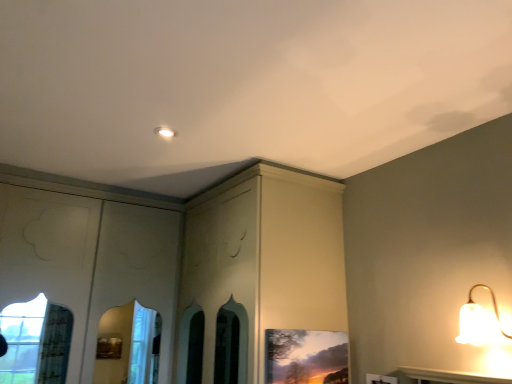
Looking at this image, what is the approximate width of matte wooden picture frame at lower center?

The width of matte wooden picture frame at lower center is 2.00 inches.

In order to face matte wooden picture frame at lower center, should I rotate leftwards or rightwards?

A 7.370 degree turn to the right will do.

What do you see at coordinates (305, 356) in the screenshot? The image size is (512, 384). I see `matte wooden picture frame at lower center` at bounding box center [305, 356].

Measure the distance between matte wooden picture frame at lower center and camera.

A distance of 2.14 meters exists between matte wooden picture frame at lower center and camera.

Measure the distance between point (288, 343) and camera.

The distance of point (288, 343) from camera is 7.32 feet.

What are the coordinates of `matte wooden picture frame at lower center` in the screenshot? It's located at (305, 356).

In order to face white frosted glass lamp at upper right, should I rotate leftwards or rightwards?

To align with it, rotate right about 29.330°.

Identify the location of white frosted glass lamp at upper right. (479, 321).

Describe the element at coordinates (479, 321) in the screenshot. I see `white frosted glass lamp at upper right` at that location.

At what (x,y) coordinates should I click in order to perform the action: click on matte wooden picture frame at lower center. Please return your answer as a coordinate pair (x, y). This screenshot has width=512, height=384. Looking at the image, I should click on [305, 356].

Does white frosted glass lamp at upper right appear on the left side of matte wooden picture frame at lower center?

Incorrect, white frosted glass lamp at upper right is not on the left side of matte wooden picture frame at lower center.

Who is more distant, white frosted glass lamp at upper right or matte wooden picture frame at lower center?

Positioned behind is matte wooden picture frame at lower center.

Between point (477, 317) and point (331, 380), which one is positioned in front?

The point (477, 317) is closer.

From the image's perspective, which one is positioned lower, white frosted glass lamp at upper right or matte wooden picture frame at lower center?

matte wooden picture frame at lower center is shown below in the image.

From a real-world perspective, does white frosted glass lamp at upper right sit lower than matte wooden picture frame at lower center?

No.

Does white frosted glass lamp at upper right have a greater width compared to matte wooden picture frame at lower center?

Indeed, white frosted glass lamp at upper right has a greater width compared to matte wooden picture frame at lower center.

Can you confirm if white frosted glass lamp at upper right is taller than matte wooden picture frame at lower center?

No, white frosted glass lamp at upper right is not taller than matte wooden picture frame at lower center.

Considering the sizes of objects white frosted glass lamp at upper right and matte wooden picture frame at lower center in the image provided, who is smaller, white frosted glass lamp at upper right or matte wooden picture frame at lower center?

matte wooden picture frame at lower center.

Which is correct: white frosted glass lamp at upper right is inside matte wooden picture frame at lower center, or outside of it?

white frosted glass lamp at upper right is spatially situated outside matte wooden picture frame at lower center.

Is white frosted glass lamp at upper right not close to matte wooden picture frame at lower center?

No.

In the scene shown: Is white frosted glass lamp at upper right aimed at matte wooden picture frame at lower center?

No, white frosted glass lamp at upper right is not oriented towards matte wooden picture frame at lower center.

Can you tell me how much white frosted glass lamp at upper right and matte wooden picture frame at lower center differ in facing direction?

There is a 88.8-degree angle between the facing directions of white frosted glass lamp at upper right and matte wooden picture frame at lower center.

Locate an element on the screen. The image size is (512, 384). picture frame located behind the white frosted glass lamp at upper right is located at coordinates (305, 356).

Which is more to the left, matte wooden picture frame at lower center or white frosted glass lamp at upper right?

Positioned to the left is matte wooden picture frame at lower center.

Is matte wooden picture frame at lower center closer to the viewer compared to white frosted glass lamp at upper right?

No, the depth of matte wooden picture frame at lower center is greater than that of white frosted glass lamp at upper right.

Does point (339, 345) come farther from viewer compared to point (472, 301)?

Yes, point (339, 345) is farther from viewer.

From the image's perspective, is matte wooden picture frame at lower center located beneath white frosted glass lamp at upper right?

Yes.

From a real-world perspective, who is located higher, matte wooden picture frame at lower center or white frosted glass lamp at upper right?

white frosted glass lamp at upper right is physically above.

Which object is thinner, matte wooden picture frame at lower center or white frosted glass lamp at upper right?

With smaller width is matte wooden picture frame at lower center.

Who is shorter, matte wooden picture frame at lower center or white frosted glass lamp at upper right?

With less height is white frosted glass lamp at upper right.

Does matte wooden picture frame at lower center have a larger size compared to white frosted glass lamp at upper right?

Actually, matte wooden picture frame at lower center might be smaller than white frosted glass lamp at upper right.

Could white frosted glass lamp at upper right be considered to be inside matte wooden picture frame at lower center?

No, white frosted glass lamp at upper right is located outside of matte wooden picture frame at lower center.

Is there a large distance between matte wooden picture frame at lower center and white frosted glass lamp at upper right?

No, there isn't a large distance between matte wooden picture frame at lower center and white frosted glass lamp at upper right.

Is matte wooden picture frame at lower center facing towards white frosted glass lamp at upper right?

Yes.

How many degrees apart are the facing directions of matte wooden picture frame at lower center and white frosted glass lamp at upper right?

The angle between the facing direction of matte wooden picture frame at lower center and the facing direction of white frosted glass lamp at upper right is 88.8 degrees.

The height and width of the screenshot is (384, 512). Identify the location of lamp on the right side of matte wooden picture frame at lower center. (479, 321).

In the image, there is a white frosted glass lamp at upper right. Find the location of `picture frame below it (from the image's perspective)`. picture frame below it (from the image's perspective) is located at coordinates (305, 356).

At what (x,y) coordinates should I click in order to perform the action: click on lamp that appears above the matte wooden picture frame at lower center (from a real-world perspective). Please return your answer as a coordinate pair (x, y). The image size is (512, 384). Looking at the image, I should click on (479, 321).